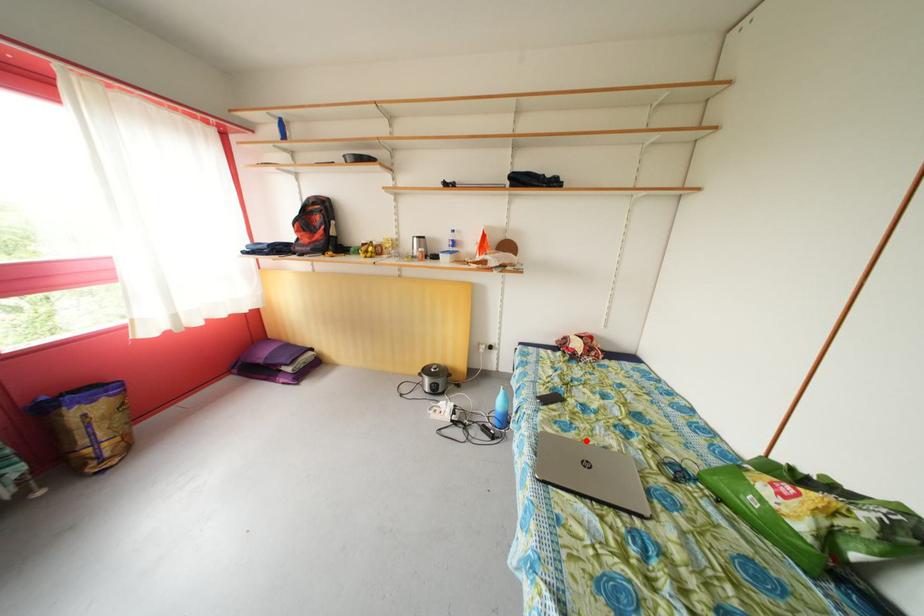
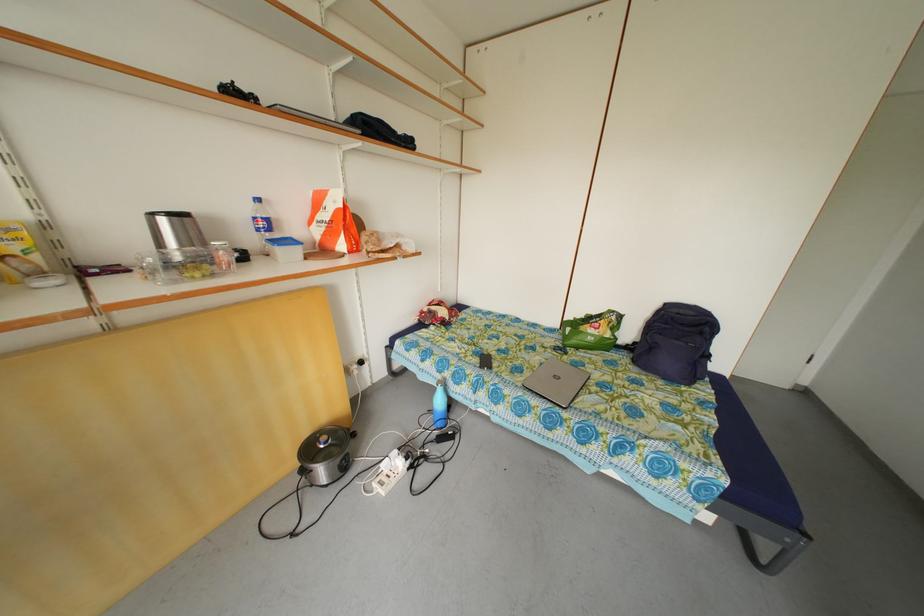
In the second image, find the point that corresponds to the highlighted location in the first image.

(535, 374)